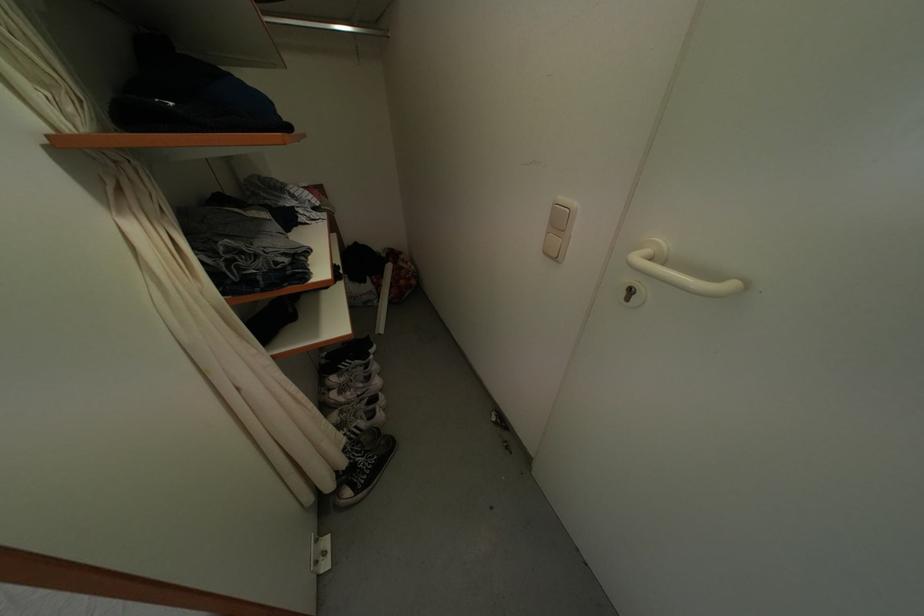
Find where to wear the black sneaker. Please return your answer as a coordinate pair (x, y).

(363, 466)